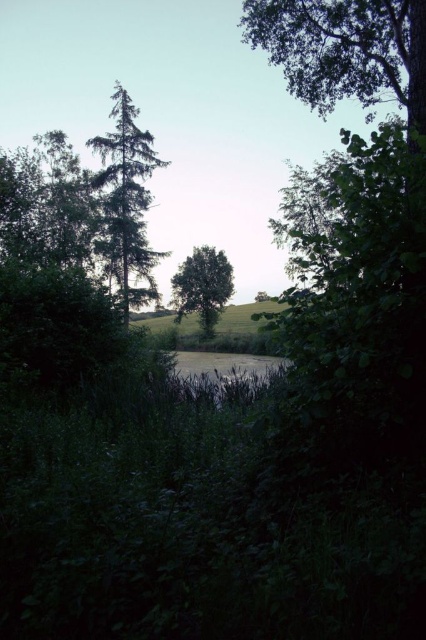
You are a hiker trying to cross a narrow path between two trees in the center of the forest. The trees are the green matte tree at center and the green leafy tree at center. Given that your backpack is 2 meters wide, will you be able to pass through the gap between them?

The gap between the green matte tree at center and the green leafy tree at center is 19.54 meters, which is wider than your backpack of 2 meters. Therefore, you can safely pass through the gap between them.

You are standing in a natural setting and want to place a small flag at each of the two points labeled point [123,273] and point [186,291]. Which point is closer to you when you are facing the scene?

Point [123,273] is closer to the camera than point [186,291], so when you are facing the scene, point [123,273] will be closer to you.